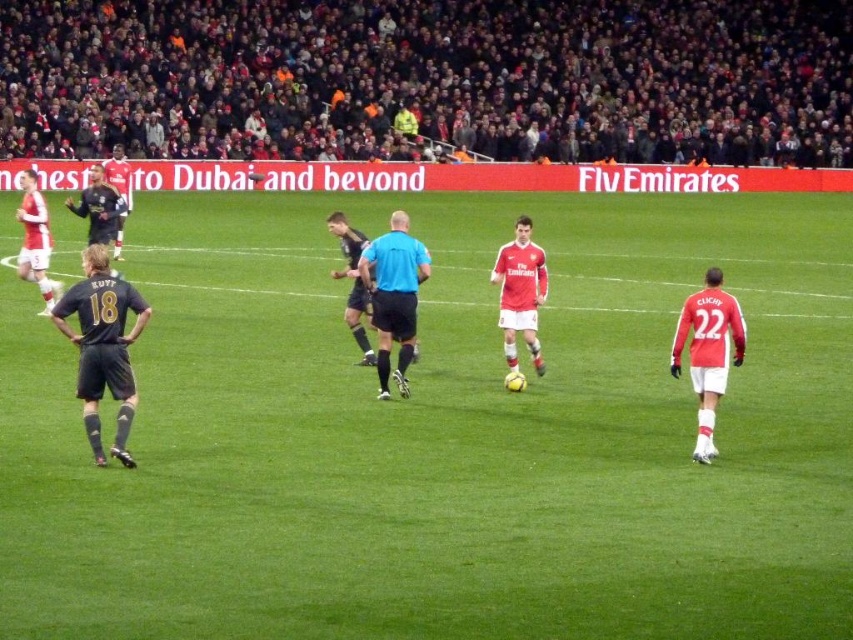
You are a soccer referee positioned at the edge of the field. You notice two players, the dark blue jersey at left and the matte red jersey at center. Which player is positioned closer to the left side of the field?

The dark blue jersey at left is positioned to the left of the matte red jersey at center, so it is closer to the left side of the field.

You are a soccer referee standing at the edge of the field. You notice the dark blue jersey at left and the matte red jersey at center. Which player is closer to the ground?

The dark blue jersey at left is positioned under the matte red jersey at center, so the dark blue jersey at left is closer to the ground.